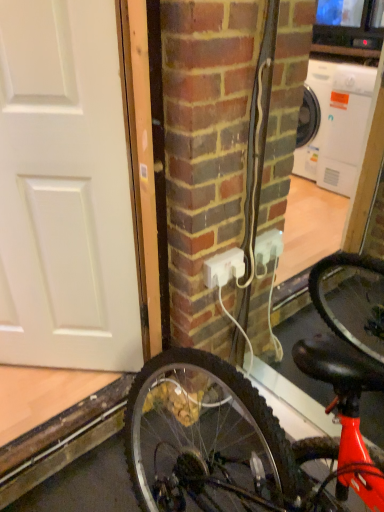
This screenshot has height=512, width=384. Describe the element at coordinates (65, 190) in the screenshot. I see `white matte door at left` at that location.

Where is `white matte door at left`? This screenshot has height=512, width=384. white matte door at left is located at coordinates (65, 190).

What do you see at coordinates (224, 268) in the screenshot? I see `white plastic power outlet at center` at bounding box center [224, 268].

You are a GUI agent. You are given a task and a screenshot of the screen. Output one action in this format:
    pyautogui.click(x=<x>, y=<y>)
    Task: Click on the white plastic power outlet at center
    This screenshot has width=384, height=512.
    Given the screenshot: What is the action you would take?
    (x=224, y=268)

Where is `white matte door at left`? The height and width of the screenshot is (512, 384). white matte door at left is located at coordinates (65, 190).

Which is more to the right, white plastic power outlet at center or white matte door at left?

white plastic power outlet at center is more to the right.

Is white plastic power outlet at center in front of or behind white matte door at left in the image?

white plastic power outlet at center is positioned farther from the viewer than white matte door at left.

Considering the points (232, 270) and (71, 133), which point is in front, point (232, 270) or point (71, 133)?

The point (71, 133) is in front.

From the image's perspective, between white plastic power outlet at center and white matte door at left, who is located below?

white plastic power outlet at center is shown below in the image.

From a real-world perspective, who is located higher, white plastic power outlet at center or white matte door at left?

In real-world perspective, white matte door at left is above.

Which of these two, white plastic power outlet at center or white matte door at left, is wider?

white matte door at left.

Considering the sizes of objects white plastic power outlet at center and white matte door at left in the image provided, who is shorter, white plastic power outlet at center or white matte door at left?

white plastic power outlet at center.

Is white plastic power outlet at center bigger than white matte door at left?

No.

Is white matte door at left located within white plastic power outlet at center?

Definitely not — white matte door at left is not inside white plastic power outlet at center.

Is white plastic power outlet at center far from white matte door at left?

No, there isn't a large distance between white plastic power outlet at center and white matte door at left.

Does white plastic power outlet at center turn towards white matte door at left?

No, white plastic power outlet at center is not turned towards white matte door at left.

What's the angular difference between white plastic power outlet at center and white matte door at left's facing directions?

white plastic power outlet at center and white matte door at left are facing 45.5 degrees away from each other.

The image size is (384, 512). I want to click on power outlet lying behind the white matte door at left, so click(x=224, y=268).

Consider the image. Which is more to the left, white matte door at left or white plastic power outlet at center?

white matte door at left is more to the left.

Is white matte door at left closer to camera compared to white plastic power outlet at center?

Yes, white matte door at left is in front of white plastic power outlet at center.

Considering the points (101, 166) and (237, 258), which point is in front, point (101, 166) or point (237, 258)?

The point (101, 166) is closer to the camera.

From the image's perspective, is white matte door at left below white plastic power outlet at center?

No, from the image's perspective, white matte door at left is not beneath white plastic power outlet at center.

From a real-world perspective, does white matte door at left sit lower than white plastic power outlet at center?

Actually, white matte door at left is physically above white plastic power outlet at center in the real world.

Considering the sizes of objects white matte door at left and white plastic power outlet at center in the image provided, who is wider, white matte door at left or white plastic power outlet at center?

Wider between the two is white matte door at left.

Which of these two, white matte door at left or white plastic power outlet at center, stands shorter?

white plastic power outlet at center is shorter.

Considering the sizes of objects white matte door at left and white plastic power outlet at center in the image provided, who is smaller, white matte door at left or white plastic power outlet at center?

white plastic power outlet at center.

Is white plastic power outlet at center completely or partially inside white matte door at left?

No, white plastic power outlet at center is not surrounded by white matte door at left.

Is white matte door at left not close to white plastic power outlet at center?

No, there isn't a large distance between white matte door at left and white plastic power outlet at center.

Is white matte door at left oriented towards white plastic power outlet at center?

No, white matte door at left is not facing towards white plastic power outlet at center.

How different are the orientations of white matte door at left and white plastic power outlet at center in degrees?

45.5 degrees.

How distant is white matte door at left from white plastic power outlet at center?

A distance of 19.26 inches exists between white matte door at left and white plastic power outlet at center.

Locate an element on the screen. The width and height of the screenshot is (384, 512). door in front of the white plastic power outlet at center is located at coordinates (65, 190).

The height and width of the screenshot is (512, 384). What are the coordinates of `power outlet below the white matte door at left (from a real-world perspective)` in the screenshot? It's located at (224, 268).

In the image, there is a white plastic power outlet at center. Identify the location of door above it (from the image's perspective). The image size is (384, 512). (65, 190).